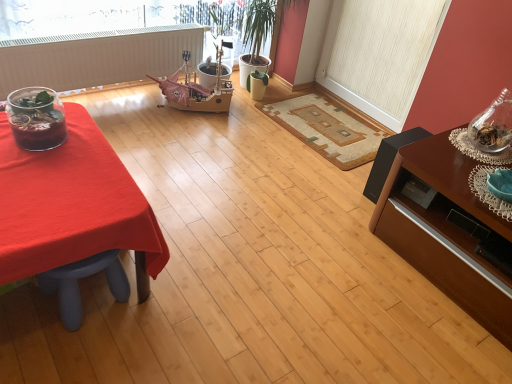
At what (x,y) coordinates should I click in order to perform the action: click on vacant space to the left of beige woven mat at center. Please return your answer as a coordinate pair (x, y). Looking at the image, I should click on (230, 134).